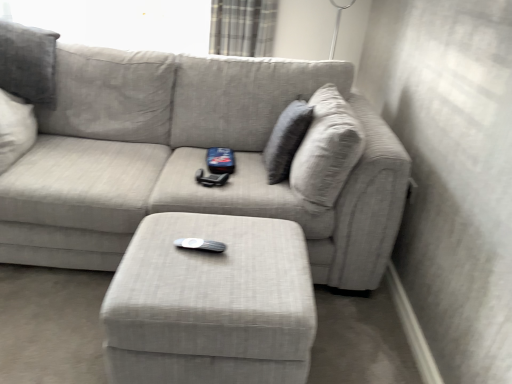
Where is `textured gray pillow at upper right`? This screenshot has height=384, width=512. textured gray pillow at upper right is located at coordinates (286, 140).

This screenshot has width=512, height=384. In order to click on textured gray pillow at upper right in this screenshot , I will do `click(286, 140)`.

From a real-world perspective, is textured gray couch at center positioned over matte gray ottoman at center based on gravity?

Indeed, from a real-world perspective, textured gray couch at center stands above matte gray ottoman at center.

Are textured gray couch at center and matte gray ottoman at center making contact?

No, textured gray couch at center is not touching matte gray ottoman at center.

Considering the sizes of objects textured gray couch at center and matte gray ottoman at center in the image provided, who is wider, textured gray couch at center or matte gray ottoman at center?

textured gray couch at center is wider.

In the scene shown: Is matte gray ottoman at center oriented towards plaid fabric curtain at upper center?

No, matte gray ottoman at center does not turn towards plaid fabric curtain at upper center.

Based on the photo, from a real-world perspective, does matte gray ottoman at center stand above plaid fabric curtain at upper center?

No, from a real-world perspective, matte gray ottoman at center is not above plaid fabric curtain at upper center.

From the image's perspective, does matte gray ottoman at center appear lower than plaid fabric curtain at upper center?

Yes, from the image's perspective, matte gray ottoman at center is below plaid fabric curtain at upper center.

Are textured gray couch at center and textured gray pillow at upper right beside each other?

No.

Does point (192, 156) lie behind point (282, 148)?

Yes, it is behind point (282, 148).

Choose the correct answer: Is textured gray couch at center inside textured gray pillow at upper right or outside it?

textured gray couch at center is spatially situated outside textured gray pillow at upper right.

Considering the relative sizes of matte gray ottoman at center and textured gray couch at center in the image provided, is matte gray ottoman at center wider than textured gray couch at center?

Incorrect, the width of matte gray ottoman at center does not surpass that of textured gray couch at center.

Is there a large distance between matte gray ottoman at center and textured gray couch at center?

No, there isn't a large distance between matte gray ottoman at center and textured gray couch at center.

From a real-world perspective, is matte gray ottoman at center positioned over textured gray couch at center based on gravity?

No, from a real-world perspective, matte gray ottoman at center is not above textured gray couch at center.

Is textured gray couch at center at the back of matte gray ottoman at center?

Yes, matte gray ottoman at center's orientation is away from textured gray couch at center.

In the scene shown: How different are the orientations of matte gray ottoman at center and textured gray pillow at upper right in degrees?

88 degrees.

Which object is further away from the camera, matte gray ottoman at center or textured gray pillow at upper right?

textured gray pillow at upper right.

Considering the sizes of matte gray ottoman at center and textured gray pillow at upper right in the image, is matte gray ottoman at center bigger or smaller than textured gray pillow at upper right?

In the image, matte gray ottoman at center appears to be larger than textured gray pillow at upper right.

Are matte gray ottoman at center and textured gray pillow at upper right far apart?

matte gray ottoman at center is actually quite close to textured gray pillow at upper right.

From a real-world perspective, is plaid fabric curtain at upper center positioned above or below textured gray pillow at upper right?

plaid fabric curtain at upper center is above textured gray pillow at upper right.

From the image's perspective, which is below, plaid fabric curtain at upper center or textured gray pillow at upper right?

textured gray pillow at upper right, from the image's perspective.

Is textured gray pillow at upper right surrounded by plaid fabric curtain at upper center?

No.

Which of these two, plaid fabric curtain at upper center or textured gray pillow at upper right, stands taller?

textured gray pillow at upper right.

Is plaid fabric curtain at upper center inside or outside of textured gray couch at center?

plaid fabric curtain at upper center is not inside textured gray couch at center, it's outside.

Is point (231, 41) more distant than point (122, 134)?

That is True.

Which of these two, plaid fabric curtain at upper center or textured gray couch at center, is smaller?

plaid fabric curtain at upper center.

The image size is (512, 384). Identify the location of table below the textured gray couch at center (from the image's perspective). (211, 303).

Where is `curtain behind the matte gray ottoman at center`? The height and width of the screenshot is (384, 512). curtain behind the matte gray ottoman at center is located at coordinates (243, 27).

Considering their positions, is matte gray ottoman at center positioned closer to textured gray pillow at upper right than plaid fabric curtain at upper center?

matte gray ottoman at center.

Considering their positions, is textured gray pillow at upper right positioned further to matte gray ottoman at center than textured gray couch at center?

Based on the image, textured gray pillow at upper right appears to be further to matte gray ottoman at center.

Looking at the image, which one is located closer to plaid fabric curtain at upper center, textured gray pillow at upper right or textured gray couch at center?

The object closer to plaid fabric curtain at upper center is textured gray couch at center.

Which object lies nearer to the anchor point textured gray couch at center, matte gray ottoman at center or textured gray pillow at upper right?

textured gray pillow at upper right is closer to textured gray couch at center.

Considering their positions, is textured gray pillow at upper right positioned further to matte gray ottoman at center than plaid fabric curtain at upper center?

plaid fabric curtain at upper center is further to matte gray ottoman at center.

Based on their spatial positions, is plaid fabric curtain at upper center or textured gray pillow at upper right closer to textured gray couch at center?

textured gray pillow at upper right is positioned closer to the anchor textured gray couch at center.

Based on their spatial positions, is textured gray couch at center or textured gray pillow at upper right further from matte gray ottoman at center?

textured gray pillow at upper right is positioned further to the anchor matte gray ottoman at center.

Looking at the image, which one is located closer to plaid fabric curtain at upper center, textured gray couch at center or matte gray ottoman at center?

Based on the image, textured gray couch at center appears to be nearer to plaid fabric curtain at upper center.

You are a GUI agent. You are given a task and a screenshot of the screen. Output one action in this format:
    pyautogui.click(x=<x>, y=<y>)
    Task: Click on the pillow between textured gray couch at center and plaid fabric curtain at upper center along the z-axis
    The height and width of the screenshot is (384, 512).
    Given the screenshot: What is the action you would take?
    pyautogui.click(x=286, y=140)

Locate an element on the screen. studio couch located between matte gray ottoman at center and plaid fabric curtain at upper center in the depth direction is located at coordinates (192, 154).

You are a GUI agent. You are given a task and a screenshot of the screen. Output one action in this format:
    pyautogui.click(x=<x>, y=<y>)
    Task: Click on the pillow between plaid fabric curtain at upper center and matte gray ottoman at center vertically
    
    Given the screenshot: What is the action you would take?
    pyautogui.click(x=286, y=140)

You are a GUI agent. You are given a task and a screenshot of the screen. Output one action in this format:
    pyautogui.click(x=<x>, y=<y>)
    Task: Click on the studio couch between textured gray pillow at upper right and matte gray ottoman at center from top to bottom
    
    Given the screenshot: What is the action you would take?
    pyautogui.click(x=192, y=154)